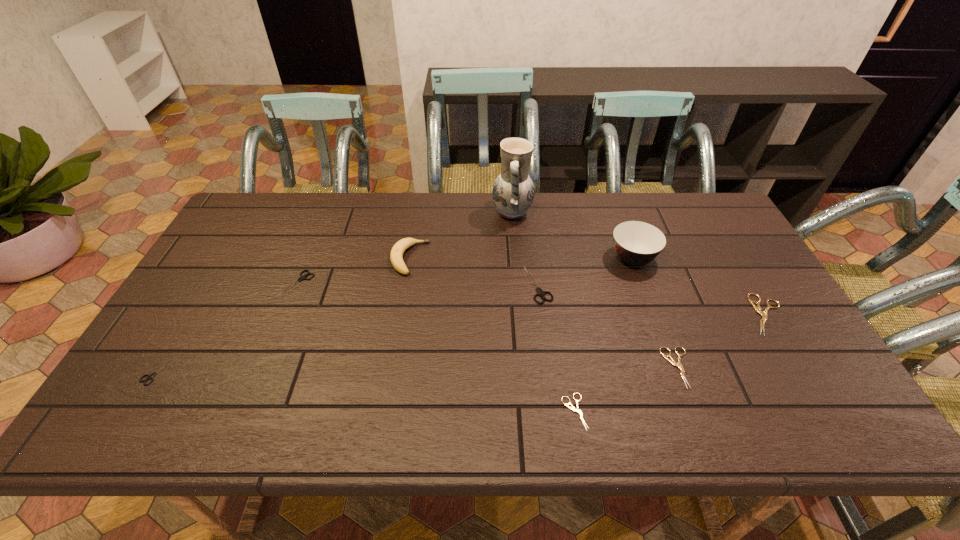
Where is `free space located on the left of the eighth shortest object`? Image resolution: width=960 pixels, height=540 pixels. free space located on the left of the eighth shortest object is located at coordinates (590, 258).

Where is `free space located on the front of the seventh shortest object`? free space located on the front of the seventh shortest object is located at coordinates (402, 303).

At what (x,y) coordinates should I click in order to perform the action: click on free region located 0.050m on the right of the fourth tallest object. Please return your answer as a coordinate pair (x, y). Looking at the image, I should click on [x=568, y=285].

Find the location of a particular element. This screenshot has width=960, height=540. vacant point located 0.150m on the right of the second shears from left to right is located at coordinates (364, 284).

Locate an element on the screen. This screenshot has width=960, height=540. vacant region located on the left of the farthest beige shears is located at coordinates (651, 315).

Locate an element on the screen. vacant space located 0.140m on the left of the second smallest beige shears is located at coordinates (607, 368).

This screenshot has height=540, width=960. What are the coordinates of `vacant space situated on the right of the nearest black shears` in the screenshot? It's located at (204, 370).

Identify the location of free spot located on the left of the shortest object. (478, 411).

The height and width of the screenshot is (540, 960). Identify the location of object located in the far edge section of the desktop. (513, 190).

Locate an element on the screen. The height and width of the screenshot is (540, 960). object located in the near edge section of the desktop is located at coordinates (572, 407).